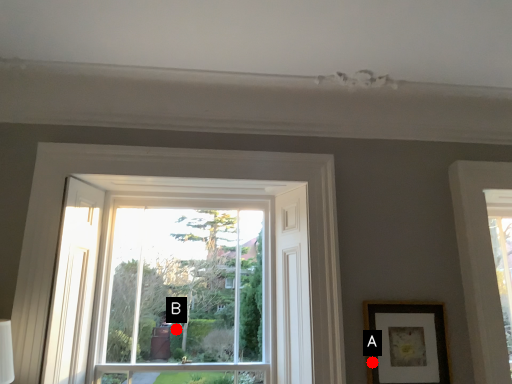
Question: Two points are circled on the image, labeled by A and B beside each circle. Among these points, which one is farthest from the camera?

Choices:
 (A) A is further
 (B) B is further

Answer: (B)